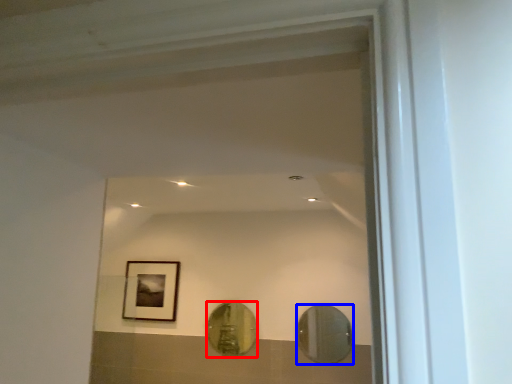
Question: Which of the following is the farthest to the observer, mirror (highlighted by a red box) or mirror (highlighted by a blue box)?

Choices:
 (A) mirror
 (B) mirror

Answer: (A)